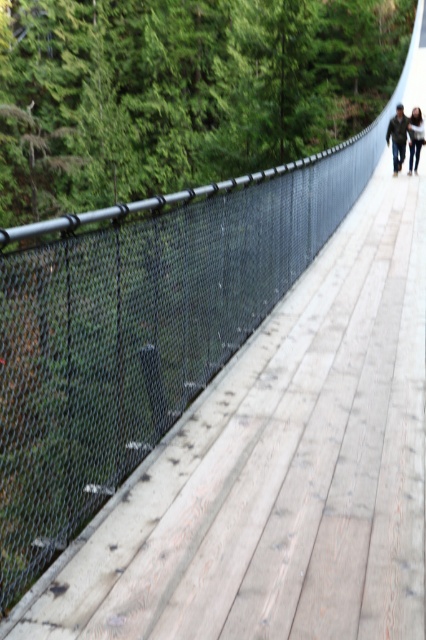
Question: Among these points, which one is farthest from the camera?

Choices:
 (A) (414, 134)
 (B) (411, 141)

Answer: (B)

Question: Can you confirm if blurred denim jacket at upper center is thinner than light brown leather jacket at upper center?

Choices:
 (A) no
 (B) yes

Answer: (A)

Question: Which object is farther from the camera taking this photo?

Choices:
 (A) blurred denim jacket at upper center
 (B) light brown leather jacket at upper center

Answer: (B)

Question: Which object is farther from the camera taking this photo?

Choices:
 (A) light brown leather jacket at upper center
 (B) blurred denim jacket at upper center

Answer: (A)

Question: Does blurred denim jacket at upper center have a larger size compared to light brown leather jacket at upper center?

Choices:
 (A) yes
 (B) no

Answer: (A)

Question: Does blurred denim jacket at upper center lie in front of light brown leather jacket at upper center?

Choices:
 (A) no
 (B) yes

Answer: (B)